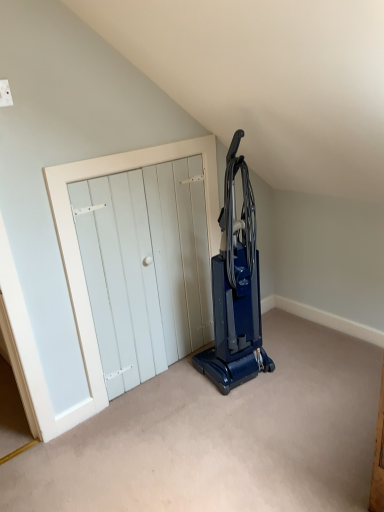
Question: Do you think blue plastic vacuum cleaner at center is within white wooden door at center, or outside of it?

Choices:
 (A) inside
 (B) outside

Answer: (B)

Question: From the image's perspective, is blue plastic vacuum cleaner at center positioned above or below white wooden door at center?

Choices:
 (A) below
 (B) above

Answer: (B)

Question: Is blue plastic vacuum cleaner at center bigger or smaller than white wooden door at center?

Choices:
 (A) small
 (B) big

Answer: (B)

Question: Considering the positions of point (195, 211) and point (246, 330), is point (195, 211) closer or farther from the camera than point (246, 330)?

Choices:
 (A) farther
 (B) closer

Answer: (A)

Question: From the image's perspective, relative to blue plastic vacuum cleaner at center, is white wooden door at center above or below?

Choices:
 (A) below
 (B) above

Answer: (A)

Question: Is white wooden door at center bigger or smaller than blue plastic vacuum cleaner at center?

Choices:
 (A) big
 (B) small

Answer: (B)

Question: Is white wooden door at center situated inside blue plastic vacuum cleaner at center or outside?

Choices:
 (A) outside
 (B) inside

Answer: (A)